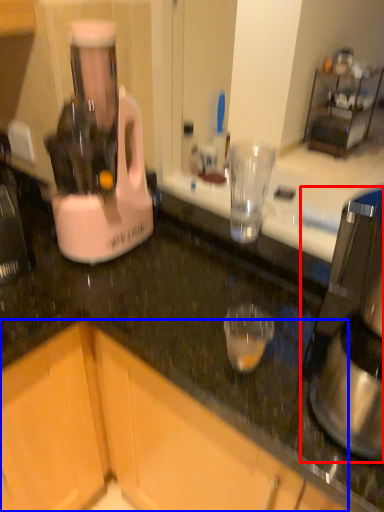
Question: Which point is further to the camera, coffee maker (highlighted by a red box) or cabinetry (highlighted by a blue box)?

Choices:
 (A) coffee maker
 (B) cabinetry

Answer: (B)